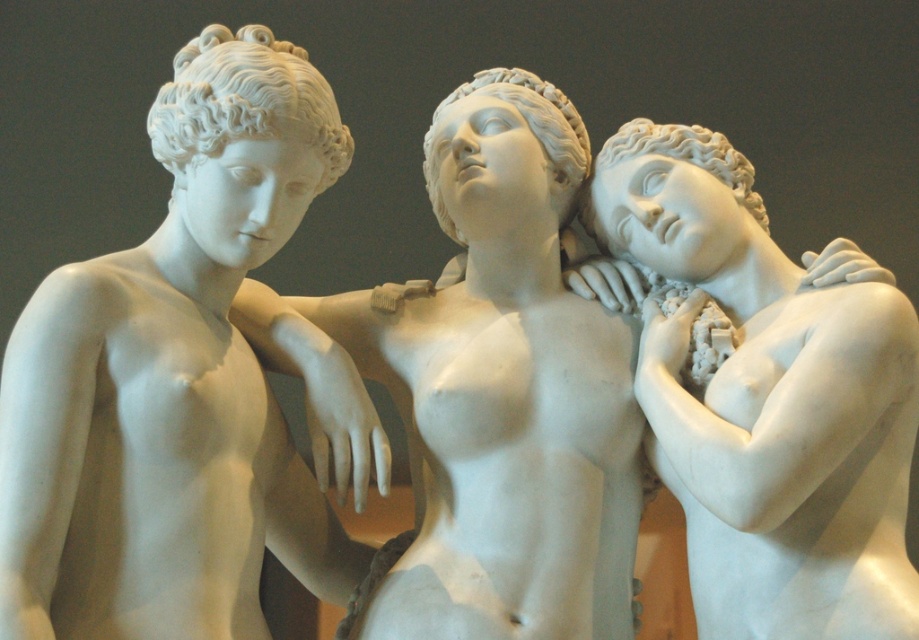
You are an art conservator assessing the structural stability of the white marble statue at left and the white marble statue at center. Which statue has a greater crosswise dimension, and thus might require a wider base to support it?

The white marble statue at center has a greater crosswise dimension than the white marble statue at left. Therefore, it would require a wider base to ensure structural stability.

You are an art conservator examining the classical marble sculpture. You notice the white marble statue at center and the white marble statue at right. Based on their positions, which statue is positioned higher up?

The white marble statue at center is positioned higher up than the white marble statue at right.